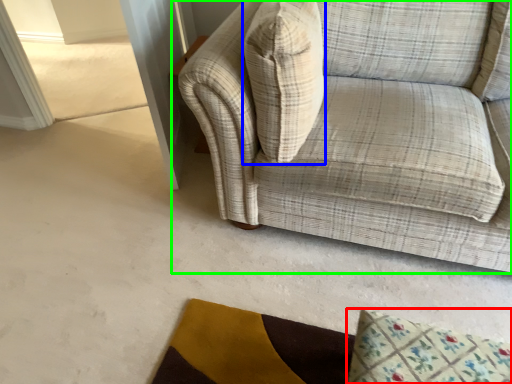
Question: Which object is positioned farthest from mat (highlighted by a red box)? Select from throw pillow (highlighted by a blue box) and studio couch (highlighted by a green box).

Choices:
 (A) throw pillow
 (B) studio couch

Answer: (A)